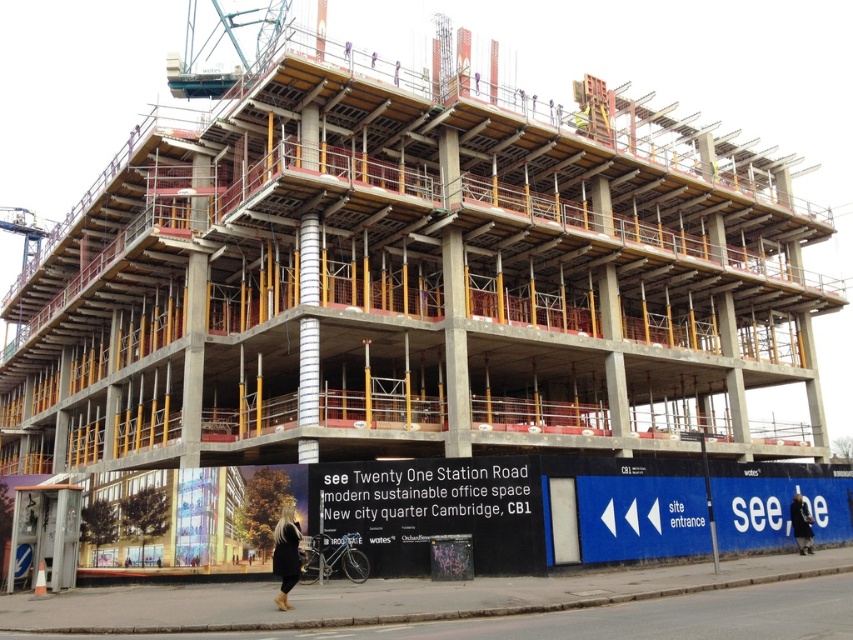
You are a delivery person who needs to place a large box on the construction site. You see the black leather jacket at lower center and the dark blue jacket at lower center. Which jacket should you avoid placing the box on to ensure it doesn

The black leather jacket at lower center is larger in size than the dark blue jacket at lower center. Therefore, you should avoid placing the box on the dark blue jacket at lower center because it is smaller and may not support the box properly.

From the picture: You are a delivery person who needs to place a box between the black leather jacket at lower center and the dark blue jacket at lower center. Can you fit the box vertically if the box is 1.2 meters tall?

The black leather jacket at lower center is taller than the dark blue jacket at lower center. Since the box is 1.2 meters tall, it can be placed vertically between them as long as the height between the jackets accommodates the box. However, the exact height difference isn

You are a delivery driver who needs to unload two jackets at the construction site. You have a black leather jacket at lower center and a dark blue jacket at lower center. The jackets need to be placed 40 meters apart for safety. Can you safely place them as required?

The distance between the black leather jacket at lower center and the dark blue jacket at lower center is 38.46 meters, which is less than the required 40 meters. Therefore, they cannot be safely placed as required.